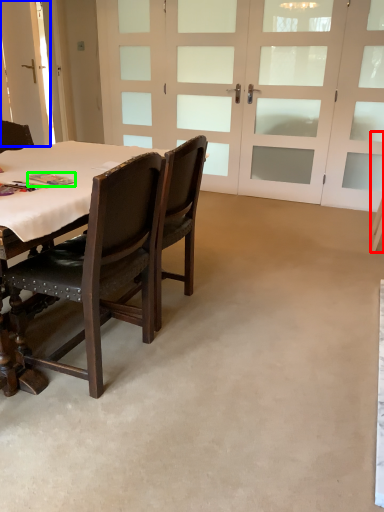
Question: Considering the real-world distances, which object is closest to chair (highlighted by a red box)? barn door (highlighted by a blue box) or book (highlighted by a green box).

Choices:
 (A) barn door
 (B) book

Answer: (B)